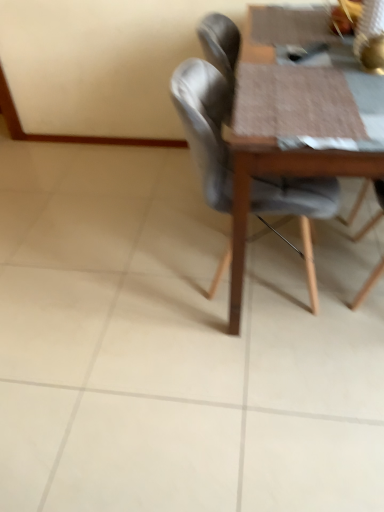
Describe the element at coordinates (205, 126) in the screenshot. I see `matte gray chair at center` at that location.

I want to click on matte gray chair at center, so click(205, 126).

What is the approximate height of wooden textured table at center?

The height of wooden textured table at center is 73.17 centimeters.

In order to click on wooden textured table at center in this screenshot , I will do `click(290, 118)`.

Describe the element at coordinates (290, 118) in the screenshot. I see `wooden textured table at center` at that location.

Locate an element on the screen. Image resolution: width=384 pixels, height=512 pixels. matte gray chair at center is located at coordinates (205, 126).

Considering the relative positions of matte gray chair at center and wooden textured table at center in the image provided, is matte gray chair at center to the right of wooden textured table at center from the viewer's perspective?

No.

Is matte gray chair at center in front of or behind wooden textured table at center in the image?

matte gray chair at center is positioned farther from the viewer than wooden textured table at center.

Which is in front, point (319, 192) or point (266, 142)?

The point (266, 142) is closer to the camera.

From the image's perspective, is matte gray chair at center above or below wooden textured table at center?

From the image's perspective, matte gray chair at center appears below wooden textured table at center.

From a real-world perspective, is matte gray chair at center over wooden textured table at center?

Yes, from a real-world perspective, matte gray chair at center is above wooden textured table at center.

Does matte gray chair at center have a greater width compared to wooden textured table at center?

No, matte gray chair at center is not wider than wooden textured table at center.

Considering the sizes of objects matte gray chair at center and wooden textured table at center in the image provided, who is shorter, matte gray chair at center or wooden textured table at center?

wooden textured table at center.

Is matte gray chair at center smaller than wooden textured table at center?

Yes, matte gray chair at center is smaller than wooden textured table at center.

Choose the correct answer: Is matte gray chair at center inside wooden textured table at center or outside it?

matte gray chair at center is inside wooden textured table at center.

Is matte gray chair at center next to wooden textured table at center and touching it?

No, matte gray chair at center is not next to wooden textured table at center.

Is matte gray chair at center oriented away from wooden textured table at center?

Yes, wooden textured table at center is at the back of matte gray chair at center.

How different are the orientations of matte gray chair at center and wooden textured table at center in degrees?

The angle between the facing direction of matte gray chair at center and the facing direction of wooden textured table at center is 90 degrees.

The width and height of the screenshot is (384, 512). What are the coordinates of `chair on the left of wooden textured table at center` in the screenshot? It's located at (205, 126).

Can you confirm if wooden textured table at center is positioned to the right of matte gray chair at center?

Correct, you'll find wooden textured table at center to the right of matte gray chair at center.

Which object is closer to the camera taking this photo, wooden textured table at center or matte gray chair at center?

wooden textured table at center is closer to the camera.

Considering the points (327, 113) and (252, 204), which point is in front, point (327, 113) or point (252, 204)?

The point (327, 113) is more forward.

From the image's perspective, which is above, wooden textured table at center or matte gray chair at center?

wooden textured table at center, from the image's perspective.

From a real-world perspective, is wooden textured table at center positioned above or below matte gray chair at center?

wooden textured table at center is below matte gray chair at center.

Is wooden textured table at center wider or thinner than matte gray chair at center?

In the image, wooden textured table at center appears to be wider than matte gray chair at center.

Considering the sizes of objects wooden textured table at center and matte gray chair at center in the image provided, who is shorter, wooden textured table at center or matte gray chair at center?

wooden textured table at center.

Which of these two, wooden textured table at center or matte gray chair at center, is smaller?

matte gray chair at center is smaller.

Choose the correct answer: Is wooden textured table at center inside matte gray chair at center or outside it?

wooden textured table at center exists outside the volume of matte gray chair at center.

Is wooden textured table at center with matte gray chair at center?

No, wooden textured table at center is not making contact with matte gray chair at center.

Looking at this image, is wooden textured table at center oriented away from matte gray chair at center?

wooden textured table at center is not turned away from matte gray chair at center.

I want to click on round table that appears below the matte gray chair at center (from a real-world perspective), so click(x=290, y=118).

The image size is (384, 512). In order to click on round table in front of the matte gray chair at center in this screenshot , I will do `click(290, 118)`.

Locate an element on the screen. chair located on the left of wooden textured table at center is located at coordinates (205, 126).